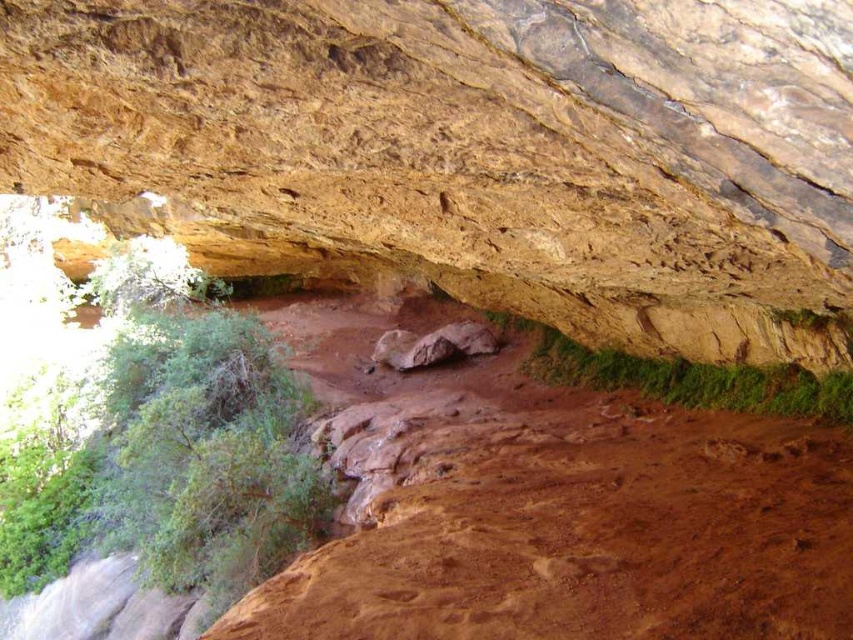
Which is more to the left, green leafy shrub at left or rusty rock at center?

Positioned to the left is green leafy shrub at left.

Is green leafy shrub at left to the left of rusty rock at center from the viewer's perspective?

Correct, you'll find green leafy shrub at left to the left of rusty rock at center.

Is point (35, 435) less distant than point (432, 358)?

Yes, it is.

This screenshot has width=853, height=640. In order to click on green leafy shrub at left in this screenshot , I will do `click(166, 448)`.

Can you confirm if brown rough rock at center is positioned to the right of green leafy shrub at left?

Indeed, brown rough rock at center is positioned on the right side of green leafy shrub at left.

Is point (177, 216) less distant than point (276, 516)?

No, it is not.

Does point (143, 204) lie behind point (189, 484)?

That is True.

Where is `brown rough rock at center`? This screenshot has width=853, height=640. brown rough rock at center is located at coordinates (469, 150).

Who is lower down, brown rough rock at center or rusty rock at center?

rusty rock at center is lower down.

Can you confirm if brown rough rock at center is wider than rusty rock at center?

Yes, brown rough rock at center is wider than rusty rock at center.

Between point (676, 35) and point (421, 346), which one is positioned in front?

Point (676, 35) is more forward.

Identify the location of brown rough rock at center. (469, 150).